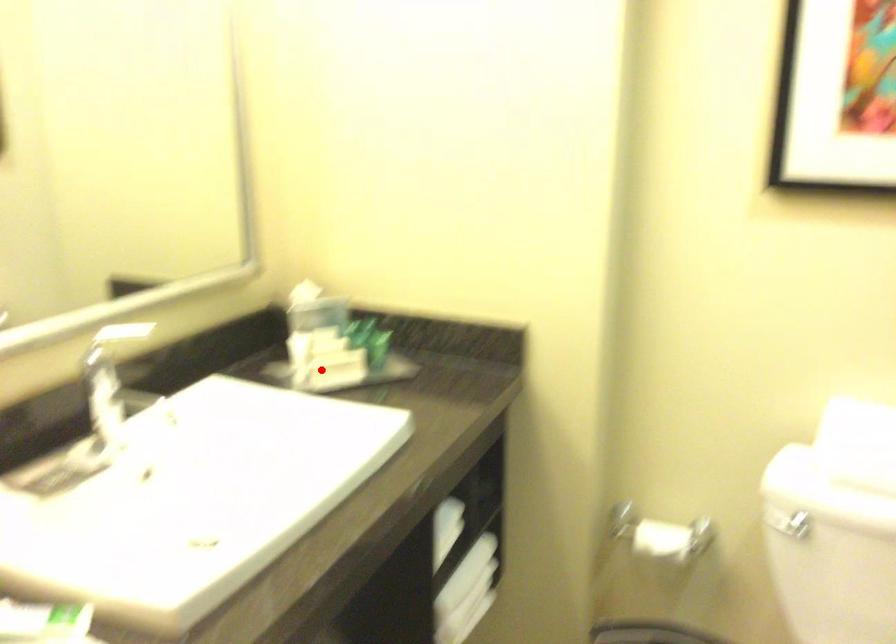
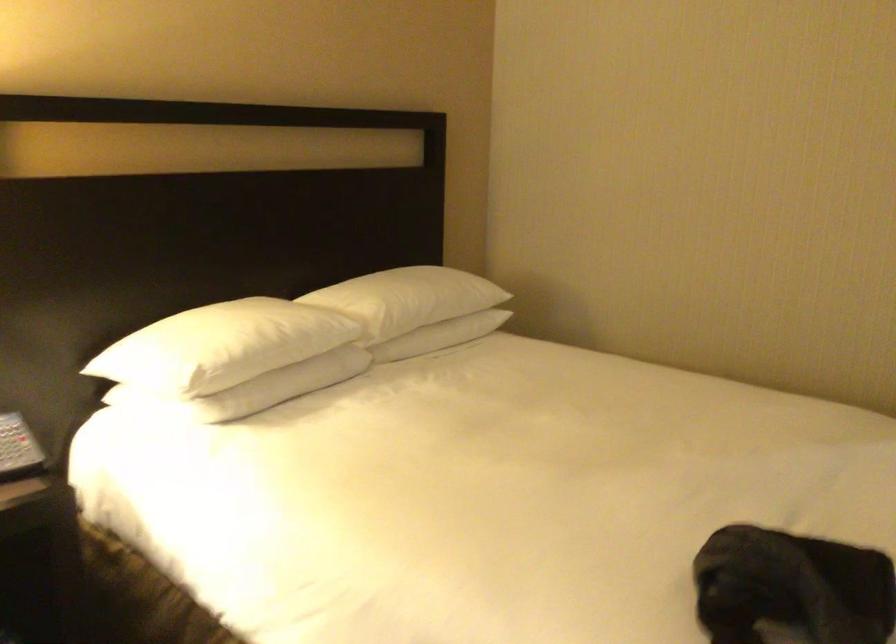
Question: I am providing you with two images of the same scene from different viewpoints. A red point is marked on the first image. At the location where the point appears in image 1, is it still visible in image 2?

Choices:
 (A) Yes
 (B) No

Answer: (B)